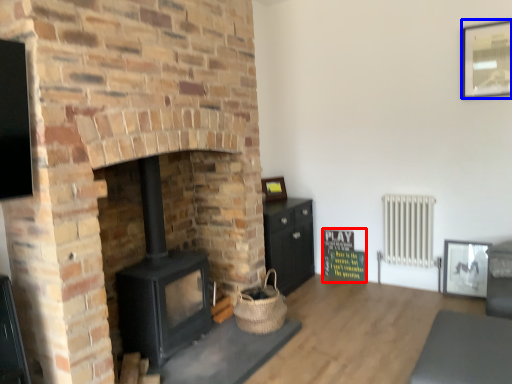
Question: Which object is closer to the camera taking this photo, bulletin board (highlighted by a red box) or picture frame (highlighted by a blue box)?

Choices:
 (A) bulletin board
 (B) picture frame

Answer: (B)